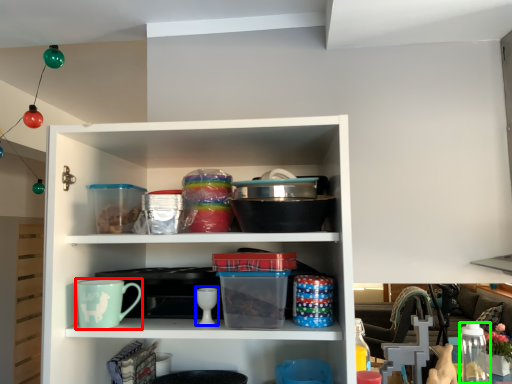
Question: Which object is positioned farthest from mug (highlighted by a red box)? Select from tableware (highlighted by a blue box) and glass jar (highlighted by a green box).

Choices:
 (A) tableware
 (B) glass jar

Answer: (B)